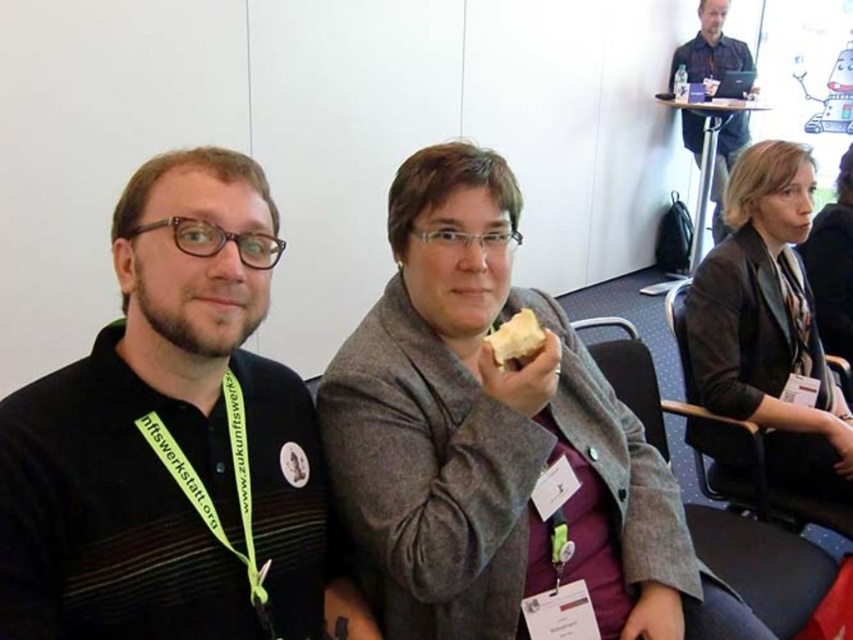
Does gray woolen coat at center have a lesser width compared to dark gray blazer at center?

In fact, gray woolen coat at center might be wider than dark gray blazer at center.

Is point (532, 476) closer to viewer compared to point (740, 348)?

Yes, it is in front of point (740, 348).

Does point (561, 419) come in front of point (784, 243)?

Yes.

Locate an element on the screen. This screenshot has height=640, width=853. gray woolen coat at center is located at coordinates (495, 440).

Is gray woolen coat at center wider than yellow matte bread at center?

Yes, gray woolen coat at center is wider than yellow matte bread at center.

Describe the element at coordinates (495, 440) in the screenshot. I see `gray woolen coat at center` at that location.

Image resolution: width=853 pixels, height=640 pixels. Describe the element at coordinates (495, 440) in the screenshot. I see `gray woolen coat at center` at that location.

Find the location of `gray woolen coat at center`. gray woolen coat at center is located at coordinates (495, 440).

Can you confirm if black matte shirt at left is wider than yellow matte bread at center?

Indeed, black matte shirt at left has a greater width compared to yellow matte bread at center.

Can you confirm if black matte shirt at left is shorter than yellow matte bread at center?

In fact, black matte shirt at left may be taller than yellow matte bread at center.

Image resolution: width=853 pixels, height=640 pixels. What are the coordinates of `black matte shirt at left` in the screenshot? It's located at (173, 442).

At what (x,y) coordinates should I click in order to perform the action: click on black matte shirt at left. Please return your answer as a coordinate pair (x, y). Looking at the image, I should click on (173, 442).